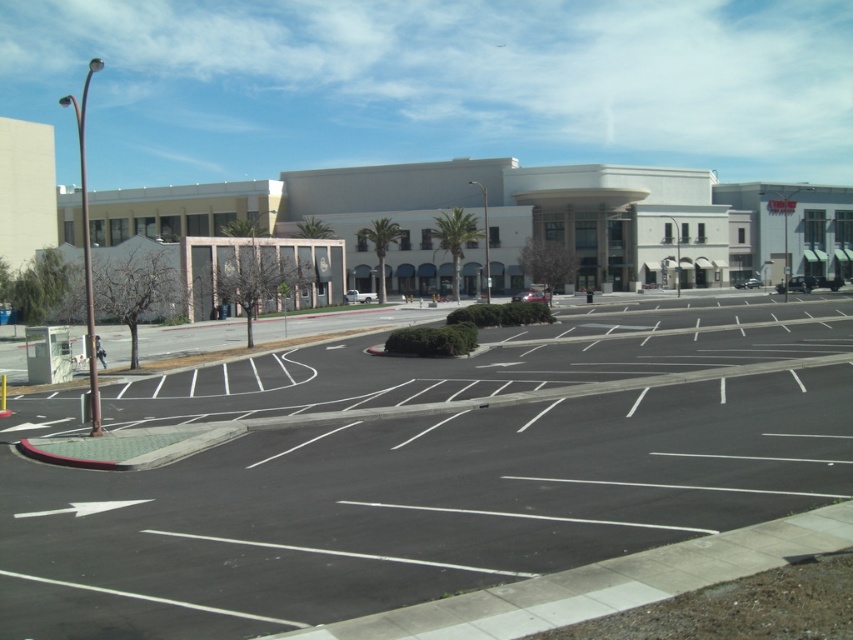
Question: Is the position of black asphalt parking lot at center less distant than that of white smooth building at center?

Choices:
 (A) no
 (B) yes

Answer: (B)

Question: Which point is farther to the camera?

Choices:
 (A) white smooth building at center
 (B) black asphalt parking lot at center

Answer: (A)

Question: Considering the relative positions of black asphalt parking lot at center and white smooth building at center in the image provided, where is black asphalt parking lot at center located with respect to white smooth building at center?

Choices:
 (A) left
 (B) right

Answer: (A)

Question: Is the position of black asphalt parking lot at center less distant than that of white smooth building at center?

Choices:
 (A) no
 (B) yes

Answer: (B)